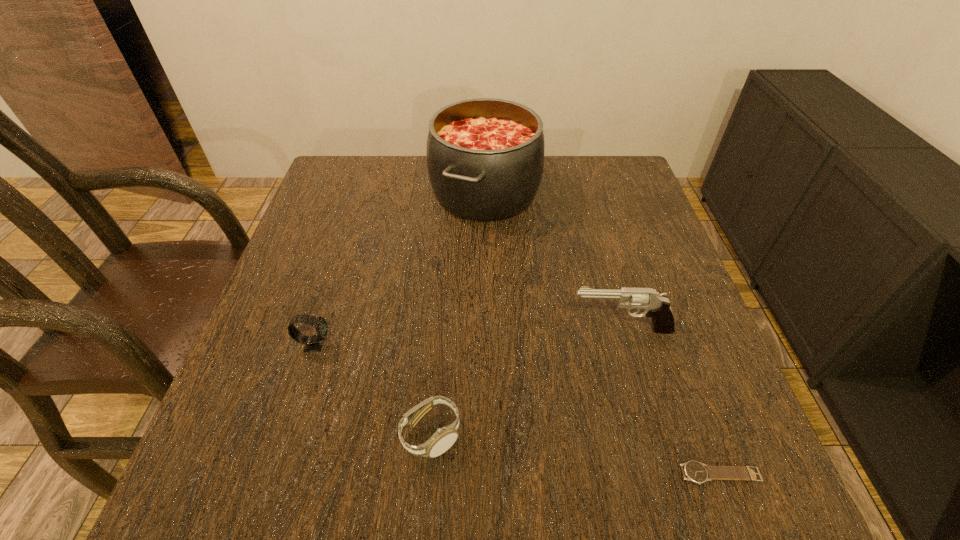
Where is `watch that is positioned at the right edge`? This screenshot has height=540, width=960. watch that is positioned at the right edge is located at coordinates (694, 471).

This screenshot has width=960, height=540. In order to click on object at the near right corner in this screenshot , I will do `click(694, 471)`.

At what (x,y) coordinates should I click in order to perform the action: click on vacant space at the far edge of the desktop. Please return your answer as a coordinate pair (x, y). The image size is (960, 540). Looking at the image, I should click on (391, 162).

I want to click on free space at the near edge of the desktop, so click(307, 498).

Where is `free space at the left edge`? Image resolution: width=960 pixels, height=540 pixels. free space at the left edge is located at coordinates (362, 212).

Locate an element on the screen. free space at the right edge is located at coordinates (627, 237).

Identify the location of vacant area at the far right corner. The image size is (960, 540). (590, 182).

This screenshot has height=540, width=960. Identify the location of empty space that is in between the second shortest object and the fourth shortest object. (526, 382).

Locate an element on the screen. Image resolution: width=960 pixels, height=540 pixels. free space that is in between the second watch from right to left and the rightmost watch is located at coordinates (576, 454).

Locate an element on the screen. This screenshot has width=960, height=540. empty location between the second tallest object and the casserole is located at coordinates (553, 261).